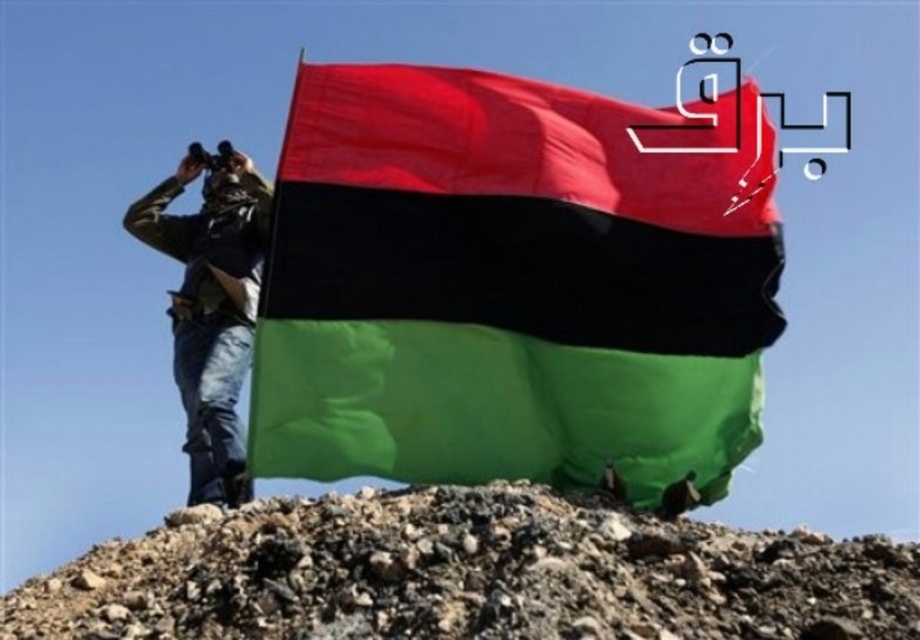
Question: Among these points, which one is farthest from the camera?

Choices:
 (A) (734, 528)
 (B) (397, 444)

Answer: (A)

Question: Is rough gravel hill at center smaller than camouflage fabric jacket at center?

Choices:
 (A) no
 (B) yes

Answer: (A)

Question: Which object is the farthest from the camouflage fabric jacket at center?

Choices:
 (A) polyester flag at center
 (B) rough gravel hill at center

Answer: (B)

Question: Does rough gravel hill at center lie in front of camouflage fabric jacket at center?

Choices:
 (A) no
 (B) yes

Answer: (B)

Question: Is polyester flag at center above rough gravel hill at center?

Choices:
 (A) no
 (B) yes

Answer: (B)

Question: Which of the following is the farthest from the observer?

Choices:
 (A) (207, 392)
 (B) (711, 589)
 (C) (713, 236)

Answer: (A)